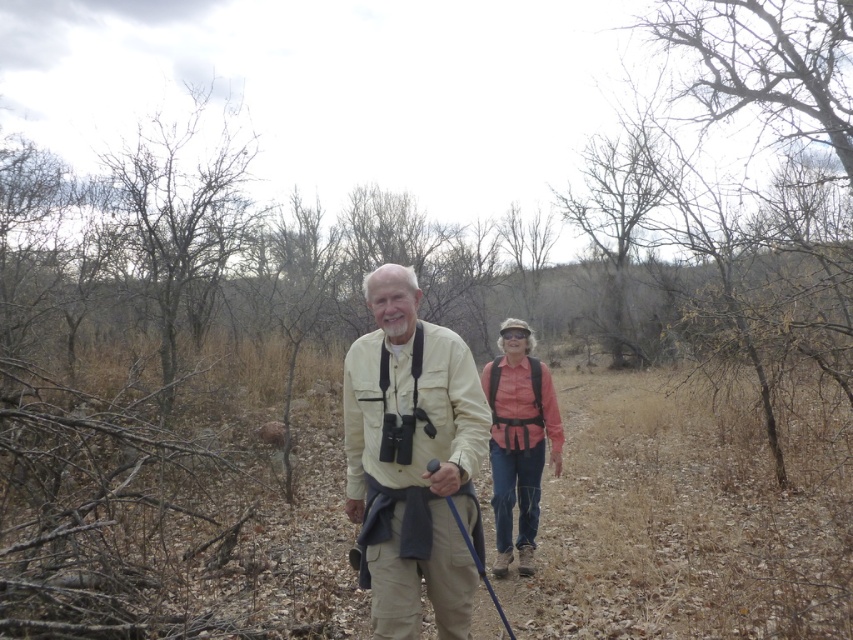
Question: Does beige fabric shirt at center appear under pink fabric shirt at center?

Choices:
 (A) yes
 (B) no

Answer: (B)

Question: Among these points, which one is nearest to the camera?

Choices:
 (A) (511, 352)
 (B) (378, 326)

Answer: (B)

Question: Does beige fabric shirt at center have a greater width compared to pink fabric shirt at center?

Choices:
 (A) no
 (B) yes

Answer: (A)

Question: Which object appears farthest from the camera in this image?

Choices:
 (A) pink fabric shirt at center
 (B) beige fabric shirt at center

Answer: (A)

Question: Is beige fabric shirt at center closer to camera compared to pink fabric shirt at center?

Choices:
 (A) no
 (B) yes

Answer: (B)